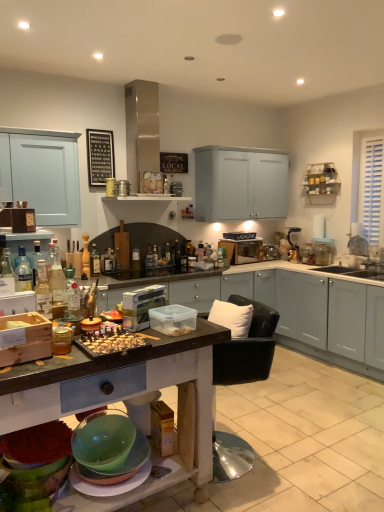
Question: Does metallic silver blender at upper right, the first appliance from the back, have a greater width compared to translucent glass bottle at center, arranged as the 6th bottle when viewed from the right?

Choices:
 (A) no
 (B) yes

Answer: (B)

Question: Considering the relative sizes of metallic silver blender at upper right, the 2th appliance in the top-to-bottom sequence, and translucent glass bottle at center, which ranks as the 4th bottle in front-to-back order, in the image provided, is metallic silver blender at upper right, the 2th appliance in the top-to-bottom sequence, shorter than translucent glass bottle at center, which ranks as the 4th bottle in front-to-back order,?

Choices:
 (A) yes
 (B) no

Answer: (B)

Question: Is metallic silver blender at upper right, positioned as the first appliance in right-to-left order, at the left side of translucent glass bottle at center, which ranks as the 4th bottle in front-to-back order?

Choices:
 (A) yes
 (B) no

Answer: (B)

Question: From the image's perspective, is metallic silver blender at upper right, the third appliance positioned from the left, beneath translucent glass bottle at center, placed as the 3th bottle when sorted from back to front?

Choices:
 (A) yes
 (B) no

Answer: (B)

Question: Does metallic silver blender at upper right, positioned as the first appliance in right-to-left order, have a lesser width compared to translucent glass bottle at center, arranged as the 6th bottle when viewed from the right?

Choices:
 (A) yes
 (B) no

Answer: (B)

Question: Is metallic silver blender at upper right, arranged as the second appliance when ordered from the bottom, bigger or smaller than metallic silver shelves at upper right?

Choices:
 (A) small
 (B) big

Answer: (A)

Question: Based on their positions, is metallic silver blender at upper right, the third appliance positioned from the left, located to the left or right of metallic silver shelves at upper right?

Choices:
 (A) right
 (B) left

Answer: (B)

Question: Considering the positions of metallic silver blender at upper right, positioned as the first appliance in right-to-left order, and metallic silver shelves at upper right in the image, is metallic silver blender at upper right, positioned as the first appliance in right-to-left order, wider or thinner than metallic silver shelves at upper right?

Choices:
 (A) wide
 (B) thin

Answer: (A)

Question: Is metallic silver blender at upper right, which is counted as the third appliance, starting from the front, in front of or behind metallic silver shelves at upper right in the image?

Choices:
 (A) behind
 (B) front

Answer: (A)

Question: Is metallic silver blender at upper right, which is counted as the third appliance, starting from the front, bigger or smaller than translucent glass bottle at center, the 2th bottle from the back?

Choices:
 (A) big
 (B) small

Answer: (A)

Question: From a real-world perspective, is metallic silver blender at upper right, positioned as the first appliance in right-to-left order, positioned above or below translucent glass bottle at center, which appears as the second bottle when viewed from the right?

Choices:
 (A) above
 (B) below

Answer: (A)

Question: Is metallic silver blender at upper right, the third appliance positioned from the left, in front of or behind translucent glass bottle at center, which appears as the second bottle when viewed from the right, in the image?

Choices:
 (A) behind
 (B) front

Answer: (A)

Question: In terms of height, does metallic silver blender at upper right, the third appliance positioned from the left, look taller or shorter compared to translucent glass bottle at center, the 5th bottle in the front-to-back sequence?

Choices:
 (A) tall
 (B) short

Answer: (A)

Question: Looking at the image, does metallic silver blender at upper right, which is counted as the third appliance, starting from the front, seem bigger or smaller compared to white soft cushion at center?

Choices:
 (A) big
 (B) small

Answer: (B)

Question: From a real-world perspective, is metallic silver blender at upper right, which is counted as the third appliance, starting from the front, physically located above or below white soft cushion at center?

Choices:
 (A) above
 (B) below

Answer: (A)